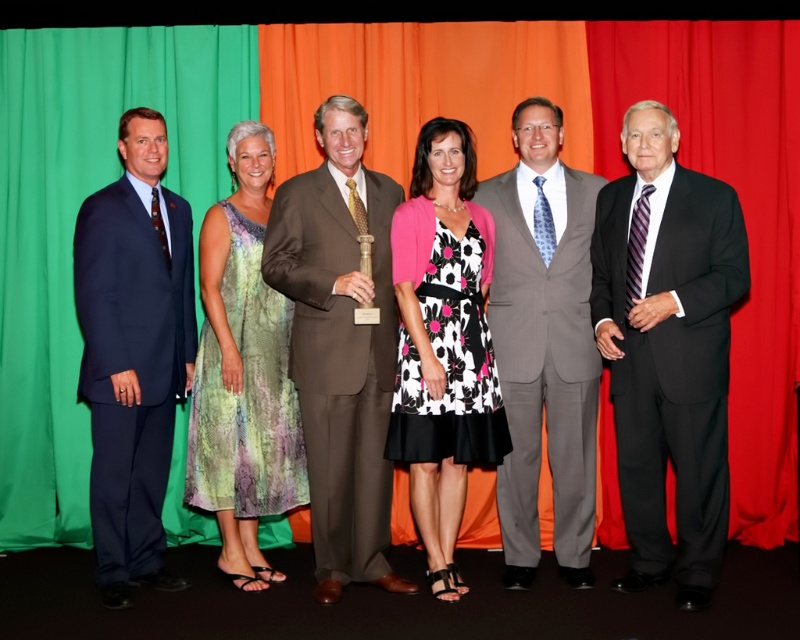
Does black suit at right come in front of matte blue suit at left?

Yes, black suit at right is closer to the viewer.

Does black suit at right appear on the left side of matte blue suit at left?

In fact, black suit at right is to the right of matte blue suit at left.

The height and width of the screenshot is (640, 800). Identify the location of black suit at right. (668, 349).

Does gray pinstripe suit at center appear over floral-patterned dress at center?

Yes.

Who is higher up, gray pinstripe suit at center or floral-patterned dress at center?

Positioned higher is gray pinstripe suit at center.

Between point (525, 364) and point (416, 170), which one is positioned in front?

Point (416, 170)

What are the coordinates of `gray pinstripe suit at center` in the screenshot? It's located at (544, 344).

Does black suit at right have a greater height compared to gray pinstripe suit at center?

No.

Is black suit at right below gray pinstripe suit at center?

Correct, black suit at right is located below gray pinstripe suit at center.

Identify the location of black suit at right. (668, 349).